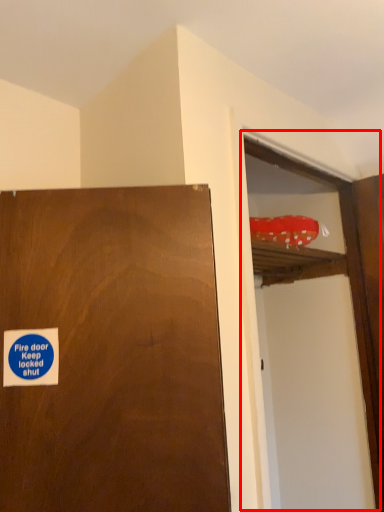
Question: From the image's perspective, what is the correct spatial positioning of screen door (annotated by the red box) in reference to sticker?

Choices:
 (A) below
 (B) above

Answer: (A)